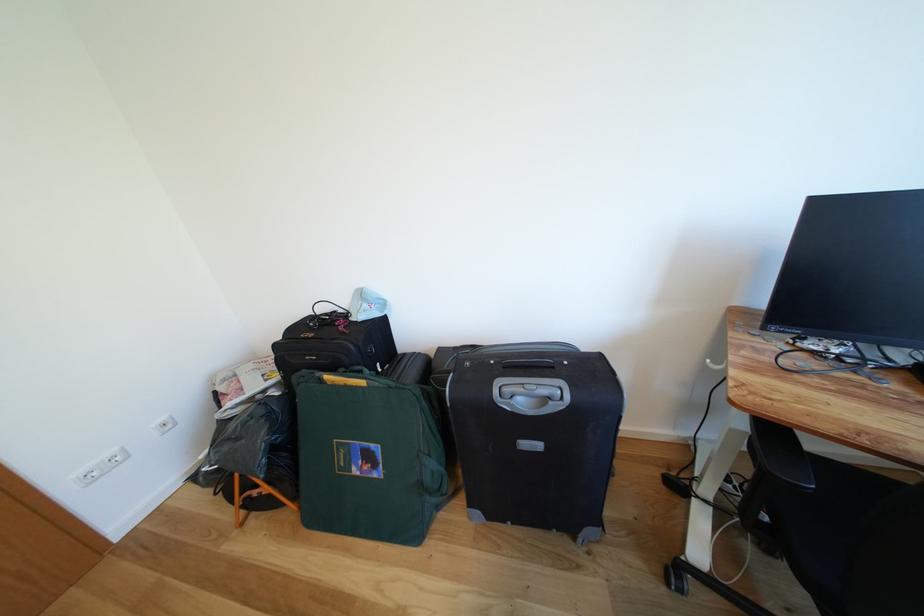
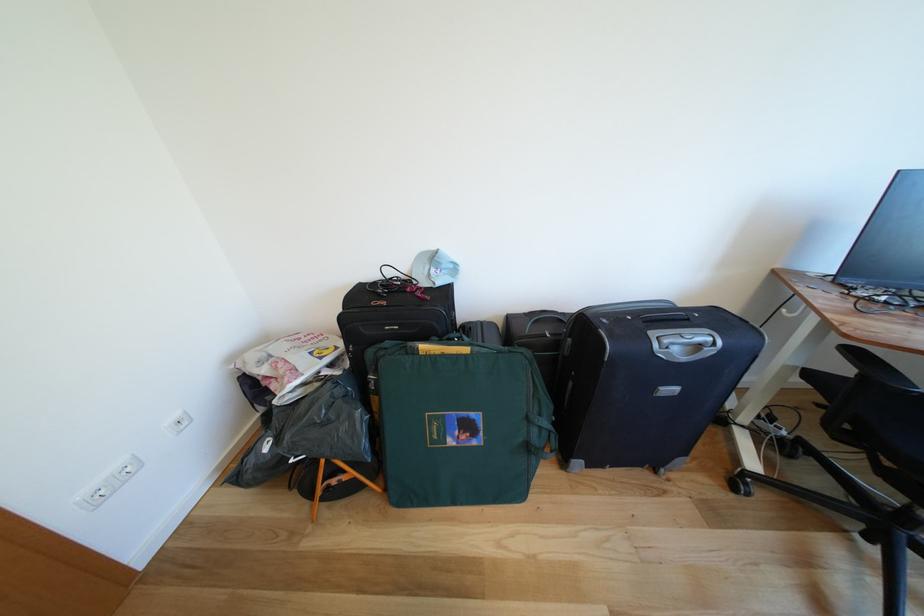
In the second image, find the point that corresponds to pixel 438 459 in the first image.

(548, 419)